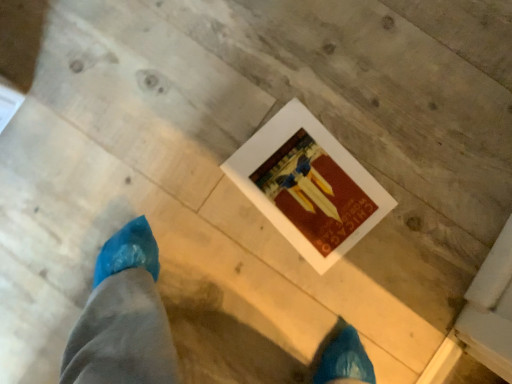
The image size is (512, 384). Identify the location of free space in front of matte paper postcard at center. (353, 296).